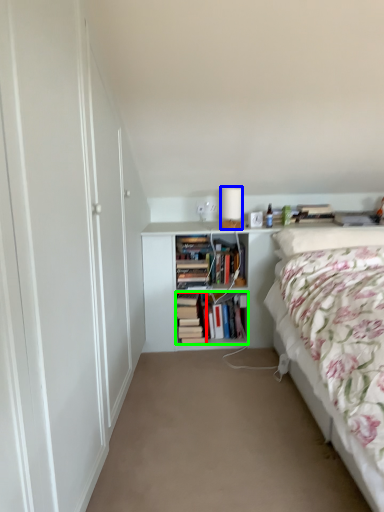
Question: Which object is the closest to the book (highlighted by a red box)? Choose among these: table lamp (highlighted by a blue box) or book (highlighted by a green box).

Choices:
 (A) table lamp
 (B) book

Answer: (B)